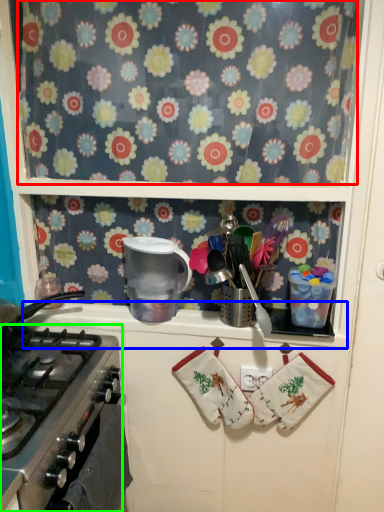
Question: Which is nearer to the flower (highlighted by a red box)? counter top (highlighted by a blue box) or gas stove (highlighted by a green box).

Choices:
 (A) counter top
 (B) gas stove

Answer: (A)